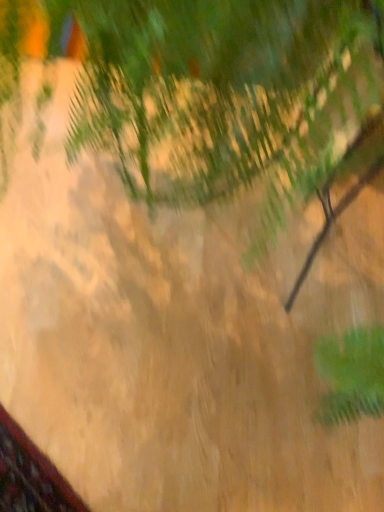
This screenshot has width=384, height=512. Find the location of `green leafy palm tree at center`. green leafy palm tree at center is located at coordinates (210, 94).

Describe the element at coordinates (210, 94) in the screenshot. This screenshot has height=512, width=384. I see `green leafy palm tree at center` at that location.

Measure the distance between green leafy palm tree at center and camera.

The distance of green leafy palm tree at center from camera is 7.86 inches.

Where is `green leafy palm tree at center`? Image resolution: width=384 pixels, height=512 pixels. green leafy palm tree at center is located at coordinates (210, 94).